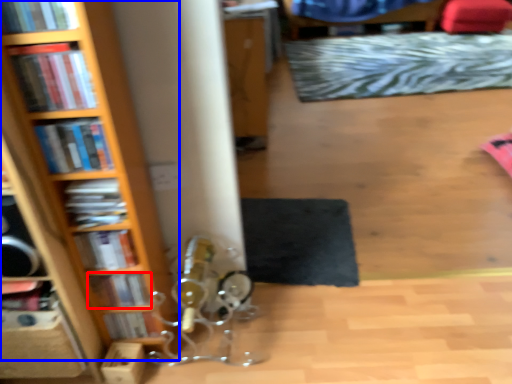
Question: Which object is closer to the camera taking this photo, book (highlighted by a red box) or bookcase (highlighted by a blue box)?

Choices:
 (A) book
 (B) bookcase

Answer: (B)